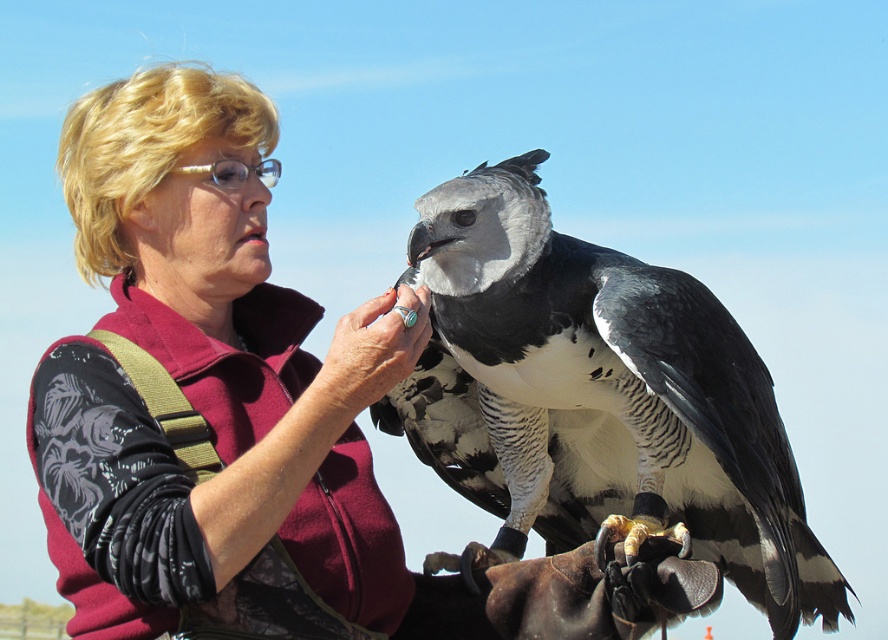
Question: Is maroon fabric at center to the right of gray/white feathers at center from the viewer's perspective?

Choices:
 (A) yes
 (B) no

Answer: (B)

Question: Is maroon fabric at center positioned before gray/white feathers at center?

Choices:
 (A) yes
 (B) no

Answer: (A)

Question: Is gray/white feathers at center bigger than turquoise ring at center?

Choices:
 (A) yes
 (B) no

Answer: (A)

Question: Among these objects, which one is farthest from the camera?

Choices:
 (A) maroon fabric at center
 (B) gray/white feathers at center
 (C) turquoise ring at center

Answer: (B)

Question: Which point is farther from the camera taking this photo?

Choices:
 (A) (324, 406)
 (B) (176, 186)

Answer: (B)

Question: Which point is farther from the camera taking this photo?

Choices:
 (A) (155, 310)
 (B) (353, 332)
 (C) (561, 516)

Answer: (C)